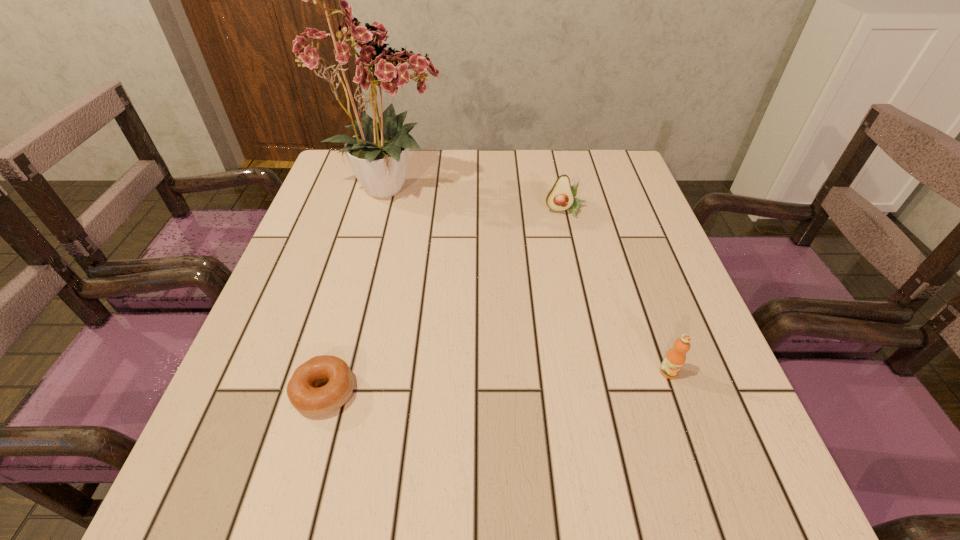
The height and width of the screenshot is (540, 960). What are the coordinates of `vacant area at the near right corner of the desktop` in the screenshot? It's located at (704, 461).

The width and height of the screenshot is (960, 540). What are the coordinates of `free point between the second object from right to left and the flower arrangement` in the screenshot? It's located at (478, 200).

I want to click on empty space between the rightmost object and the second object from right to left, so click(x=617, y=292).

At what (x,y) coordinates should I click in order to perform the action: click on vacant point located between the flower arrangement and the shortest object. Please return your answer as a coordinate pair (x, y). Looking at the image, I should click on (357, 290).

I want to click on vacant region between the orange juice and the flower arrangement, so click(x=529, y=280).

Image resolution: width=960 pixels, height=540 pixels. Find the location of `vacant area between the avocado and the orange juice`. vacant area between the avocado and the orange juice is located at coordinates (617, 292).

The height and width of the screenshot is (540, 960). Find the location of `vacant point located between the tallest object and the second object from right to left`. vacant point located between the tallest object and the second object from right to left is located at coordinates (478, 200).

Find the location of a particular element. Image resolution: width=960 pixels, height=540 pixels. free space between the shortest object and the second object from right to left is located at coordinates (444, 302).

Where is `free area in between the avocado and the bagel`? The image size is (960, 540). free area in between the avocado and the bagel is located at coordinates (444, 302).

Identify the location of vacant area between the avocado and the tallest object. (478, 200).